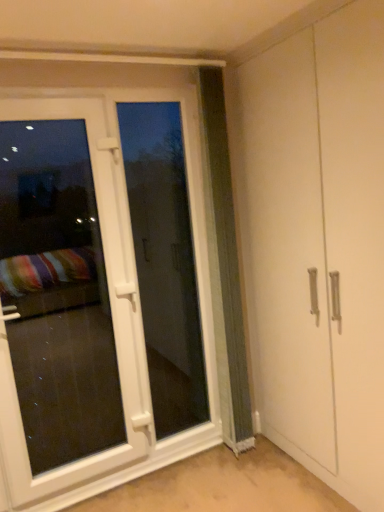
Question: Is green textured curtain at center oriented away from white glossy door at left?

Choices:
 (A) yes
 (B) no

Answer: (B)

Question: From a real-world perspective, is green textured curtain at center located higher than white glossy door at left?

Choices:
 (A) no
 (B) yes

Answer: (B)

Question: Is green textured curtain at center completely or partially outside of white glossy door at left?

Choices:
 (A) yes
 (B) no

Answer: (A)

Question: From the image's perspective, does green textured curtain at center appear higher than white glossy door at left?

Choices:
 (A) yes
 (B) no

Answer: (A)

Question: Can you confirm if green textured curtain at center is positioned to the left of white glossy door at left?

Choices:
 (A) no
 (B) yes

Answer: (A)

Question: Looking at their shapes, would you say white plastic screen door at left is wider or thinner than white glossy door at left?

Choices:
 (A) wide
 (B) thin

Answer: (B)

Question: Looking at the image, does white plastic screen door at left seem bigger or smaller compared to white glossy door at left?

Choices:
 (A) big
 (B) small

Answer: (B)

Question: Considering the positions of white plastic screen door at left and white glossy door at left in the image, is white plastic screen door at left taller or shorter than white glossy door at left?

Choices:
 (A) tall
 (B) short

Answer: (A)

Question: Is point (119, 102) closer or farther from the camera than point (4, 421)?

Choices:
 (A) closer
 (B) farther

Answer: (B)

Question: Is point (43, 147) positioned closer to the camera than point (158, 189)?

Choices:
 (A) farther
 (B) closer

Answer: (B)

Question: Considering the relative positions of white glossy door at left and white plastic screen door at left in the image provided, is white glossy door at left to the left or to the right of white plastic screen door at left?

Choices:
 (A) right
 (B) left

Answer: (B)

Question: Is white glossy door at left in front of or behind white plastic screen door at left in the image?

Choices:
 (A) front
 (B) behind

Answer: (A)

Question: From a real-world perspective, is white glossy door at left positioned above or below white plastic screen door at left?

Choices:
 (A) above
 (B) below

Answer: (B)

Question: Based on their sizes in the image, would you say green textured curtain at center is bigger or smaller than white glossy door at left?

Choices:
 (A) big
 (B) small

Answer: (B)

Question: Is point (226, 209) closer or farther from the camera than point (21, 232)?

Choices:
 (A) closer
 (B) farther

Answer: (B)